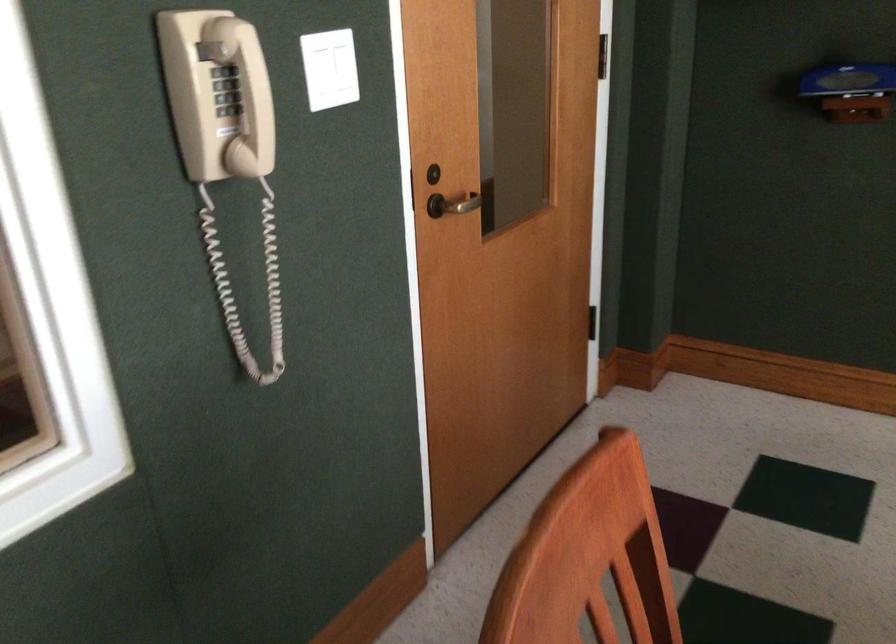
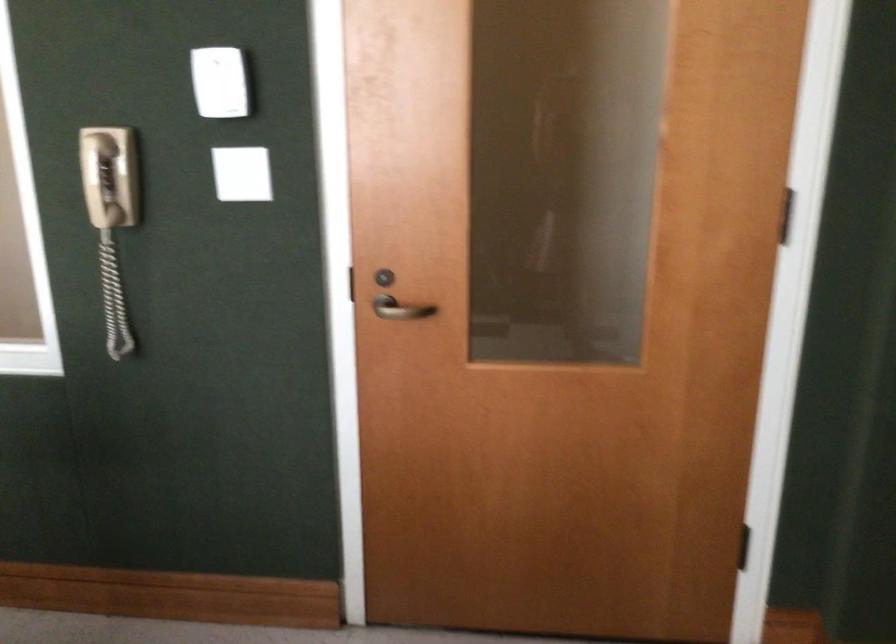
Locate, in the second image, the point that corresponds to point (455, 194) in the first image.

(401, 308)